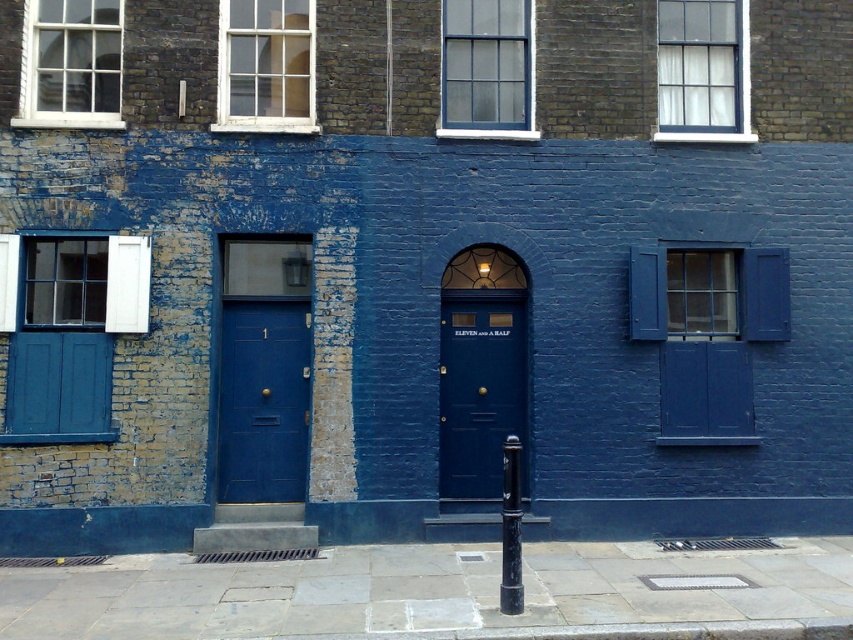
Question: Does matte blue door at left have a smaller size compared to matte blue door at center?

Choices:
 (A) yes
 (B) no

Answer: (A)

Question: Which point appears farthest from the camera in this image?

Choices:
 (A) (3, 438)
 (B) (717, 90)
 (C) (271, 1)

Answer: (B)

Question: Among these points, which one is nearest to the camera?

Choices:
 (A) (463, 362)
 (B) (90, 401)

Answer: (B)

Question: Is white glass window at upper left positioned before white wooden window at upper center?

Choices:
 (A) no
 (B) yes

Answer: (B)

Question: Which object is positioned farthest from the white glass window at upper left?

Choices:
 (A) matte glass window at center
 (B) matte blue window at right
 (C) matte blue door at left

Answer: (B)

Question: Is white glass window at upper right wider than white glass window at upper left?

Choices:
 (A) yes
 (B) no

Answer: (A)